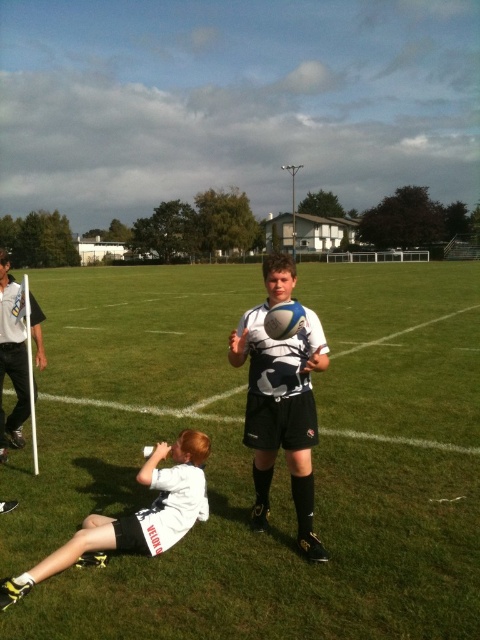
Question: Among these points, which one is nearest to the camera?

Choices:
 (A) (243, 442)
 (B) (21, 332)
 (C) (191, 368)

Answer: (A)

Question: Which point is closer to the camera?

Choices:
 (A) (284, 436)
 (B) (35, 342)
 (C) (451, 486)
 (D) (197, 451)

Answer: (A)

Question: Can you confirm if white matte rugby ball at center is wider than white plastic flag at left?

Choices:
 (A) yes
 (B) no

Answer: (B)

Question: Is green grass at center above white matte water bottle at lower left?

Choices:
 (A) yes
 (B) no

Answer: (A)

Question: Which of the following is the closest to the observer?

Choices:
 (A) click(x=241, y=488)
 (B) click(x=154, y=486)

Answer: (B)

Question: Is white matte rugby ball at center positioned behind white matte water bottle at lower left?

Choices:
 (A) no
 (B) yes

Answer: (B)